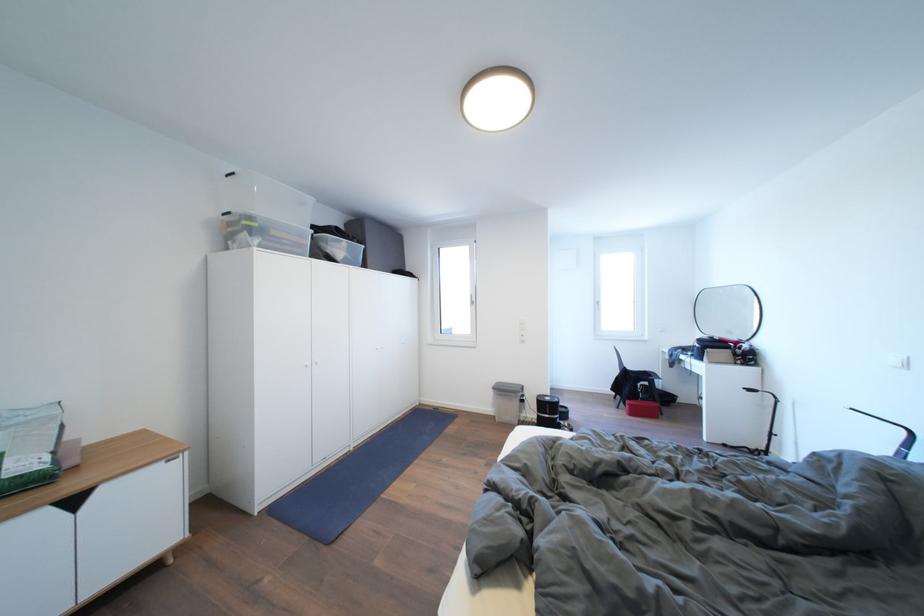
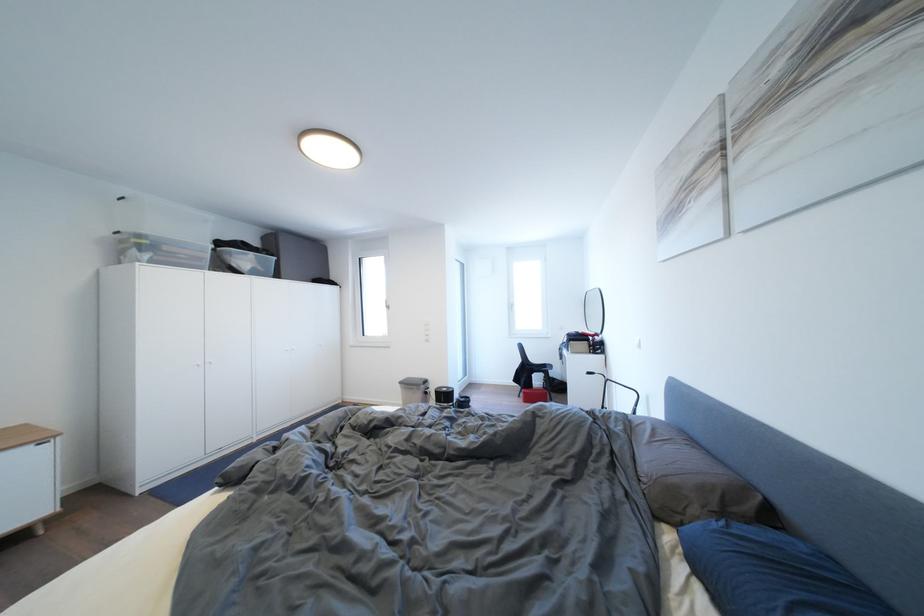
Find the pixel in the second image that matches point (638, 410) in the first image.

(532, 398)